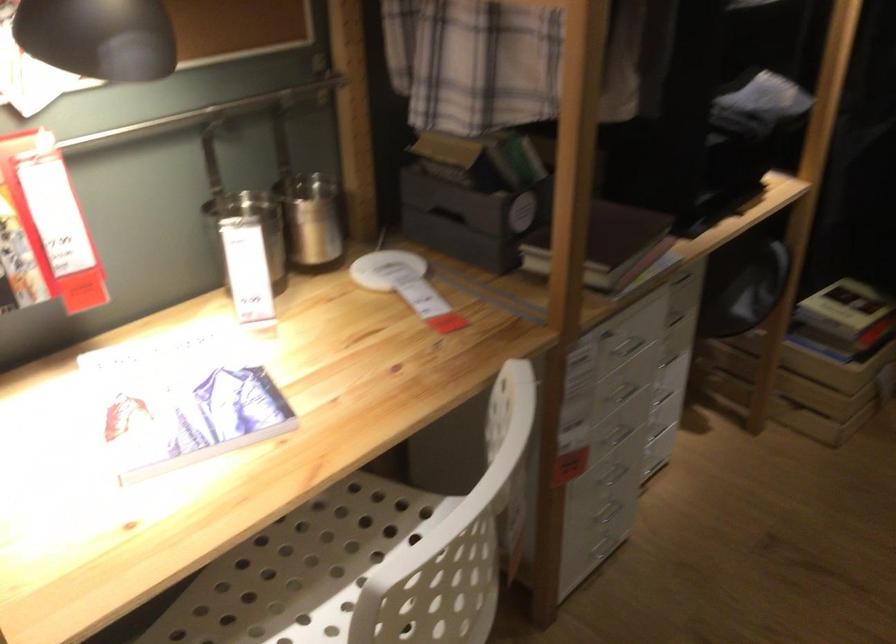
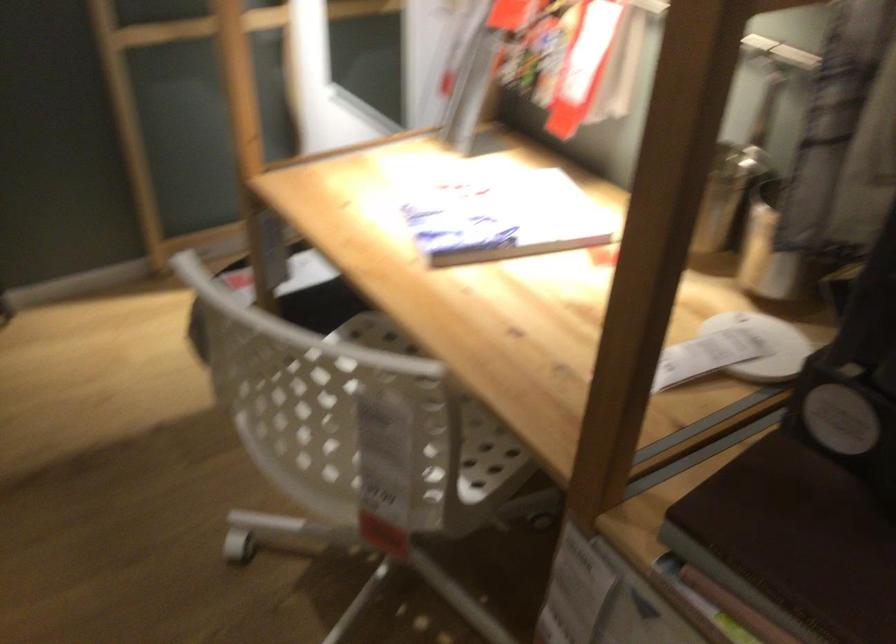
In the second image, find the point that corresponds to the point at 521,451 in the first image.

(371, 418)